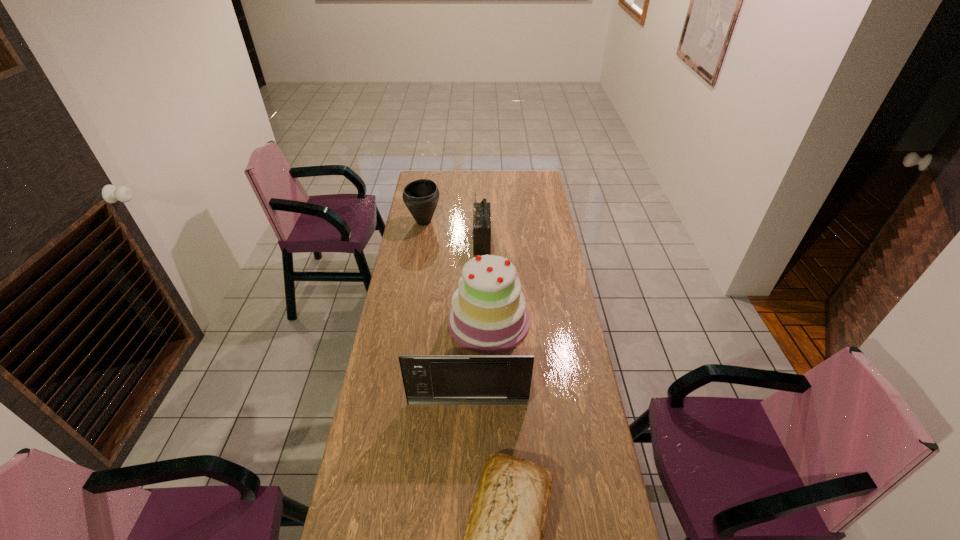
The height and width of the screenshot is (540, 960). I want to click on radio receiver, so click(481, 211).

Identify the location of cake. (488, 315).

Locate an element on the screen. This screenshot has width=960, height=540. the second nearest object is located at coordinates pyautogui.click(x=428, y=379).

This screenshot has height=540, width=960. Identify the location of urn. (421, 196).

Image resolution: width=960 pixels, height=540 pixels. I want to click on free point located 0.310m on the front panel of the radio receiver, so click(411, 241).

In order to click on free region located 0.130m on the front panel of the radio receiver in this screenshot , I will do `click(447, 241)`.

I want to click on blank area located 0.280m on the front panel of the radio receiver, so click(417, 241).

You are a GUI agent. You are given a task and a screenshot of the screen. Output one action in this format:
    pyautogui.click(x=<x>, y=<y>)
    Task: Click on the vacant region located 0.180m on the right of the third farthest object
    
    Given the screenshot: What is the action you would take?
    pyautogui.click(x=574, y=321)

Locate an element on the screen. free space located on the front panel of the microwave oven is located at coordinates (466, 521).

Where is `vacant region located 0.070m on the right of the fourth tallest object`? Image resolution: width=960 pixels, height=540 pixels. vacant region located 0.070m on the right of the fourth tallest object is located at coordinates (454, 222).